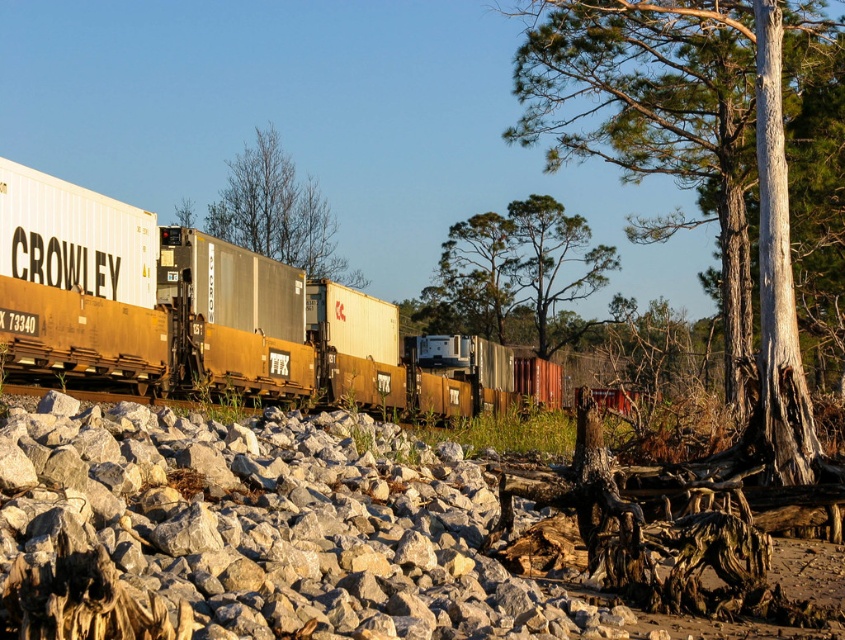
You are a railway inspector standing at the origin point of the coordinate system. You need to locate the rusty metal train car at center. What are its coordinates?

The coordinates of the rusty metal train car at center are at point [189,310].

You are a photographer standing on the railway embankment. You want to take a photo of the rusty metal train car at center and the green leafy tree at center. Which object should you position yourself to the right of to ensure both are in the frame?

You should position yourself to the right of the green leafy tree at center because the rusty metal train car at center is to the left of it, so both will be in the frame when you stand there.